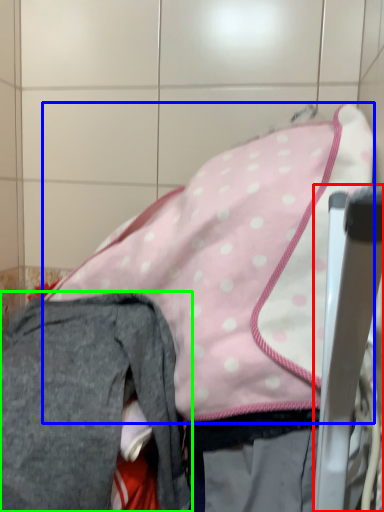
Question: Based on their relative distances, which object is nearer to chair (highlighted by a red box)? Choose from wide (highlighted by a blue box) and trousers (highlighted by a green box).

Choices:
 (A) wide
 (B) trousers

Answer: (A)